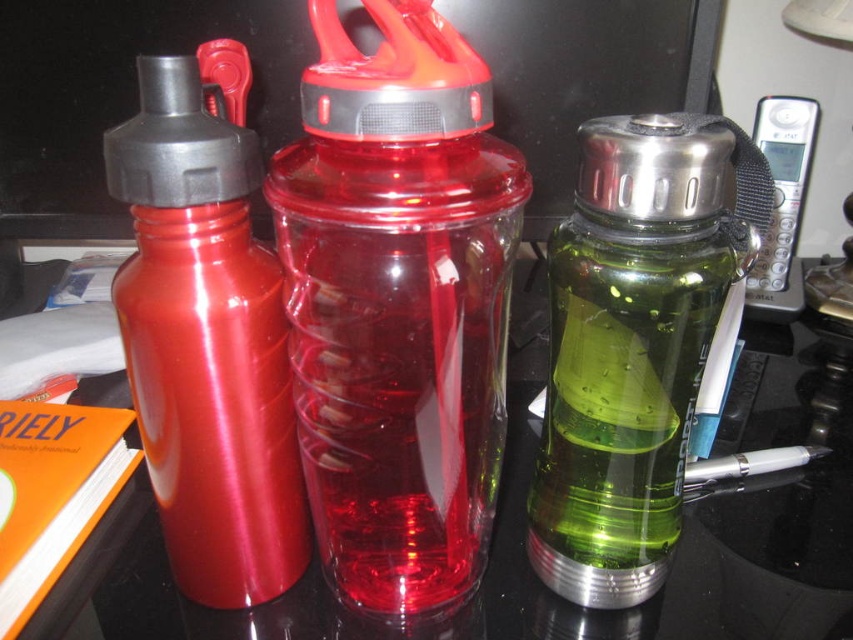
What do you see at coordinates (398, 304) in the screenshot? The width and height of the screenshot is (853, 640). I see `transparent plastic bottle at center` at bounding box center [398, 304].

In the scene shown: Is transparent plastic bottle at center behind green translucent water bottle at center?

That is False.

Is point (374, 371) in front of point (677, 220)?

Yes.

The image size is (853, 640). I want to click on transparent plastic bottle at center, so click(x=398, y=304).

Which is behind, point (653, 449) or point (248, 444)?

Positioned behind is point (653, 449).

Which is more to the left, green translucent water bottle at center or metallic red water bottle at left?

metallic red water bottle at left

What do you see at coordinates (635, 342) in the screenshot? This screenshot has width=853, height=640. I see `green translucent water bottle at center` at bounding box center [635, 342].

The image size is (853, 640). I want to click on green translucent water bottle at center, so click(635, 342).

Can you confirm if transparent plastic bottle at center is positioned below metallic red water bottle at left?

Yes, transparent plastic bottle at center is below metallic red water bottle at left.

Can you confirm if transparent plastic bottle at center is positioned to the right of metallic red water bottle at left?

Indeed, transparent plastic bottle at center is positioned on the right side of metallic red water bottle at left.

Does point (445, 317) come behind point (247, 145)?

That is False.

Image resolution: width=853 pixels, height=640 pixels. I want to click on transparent plastic bottle at center, so click(398, 304).